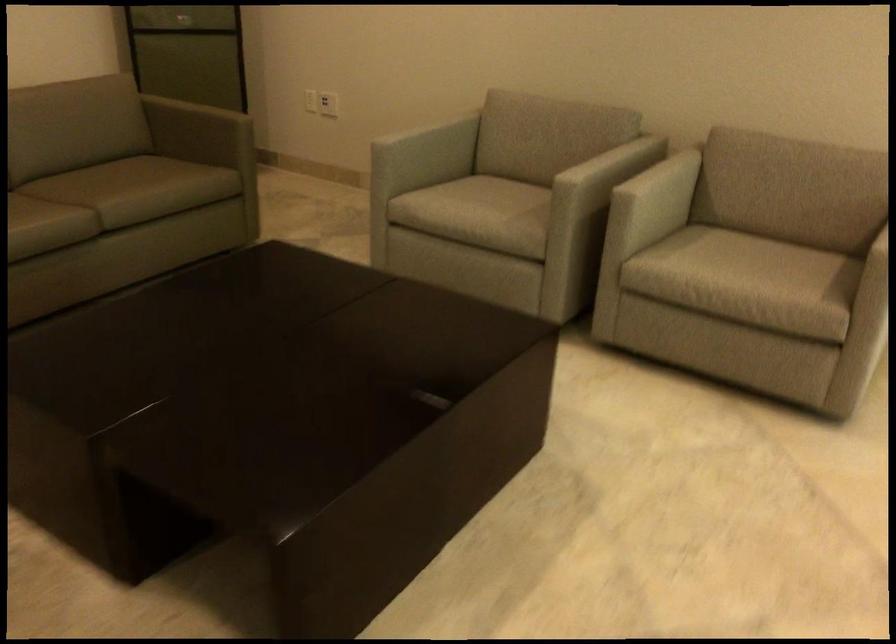
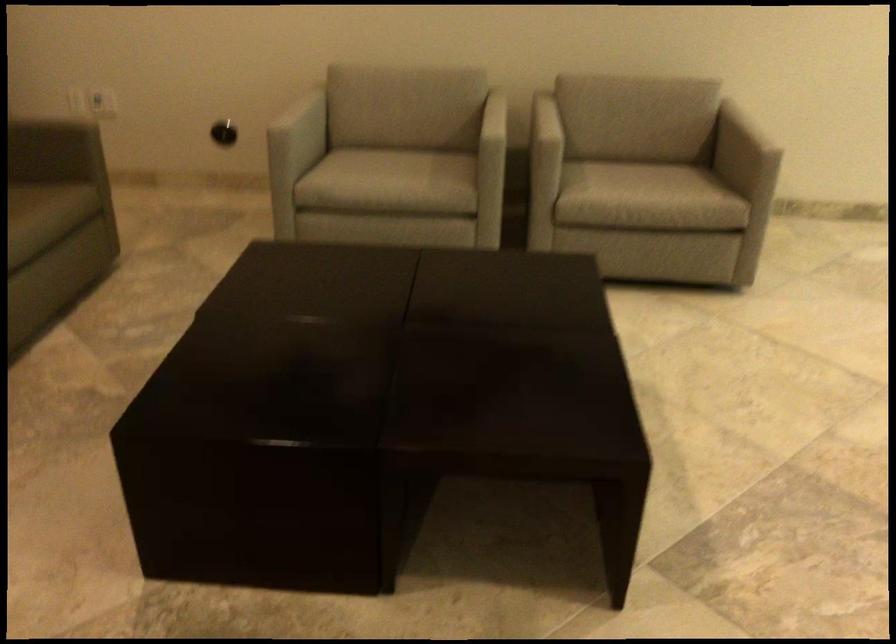
In the second image, find the point that corresponds to (x=477, y=211) in the first image.

(390, 176)